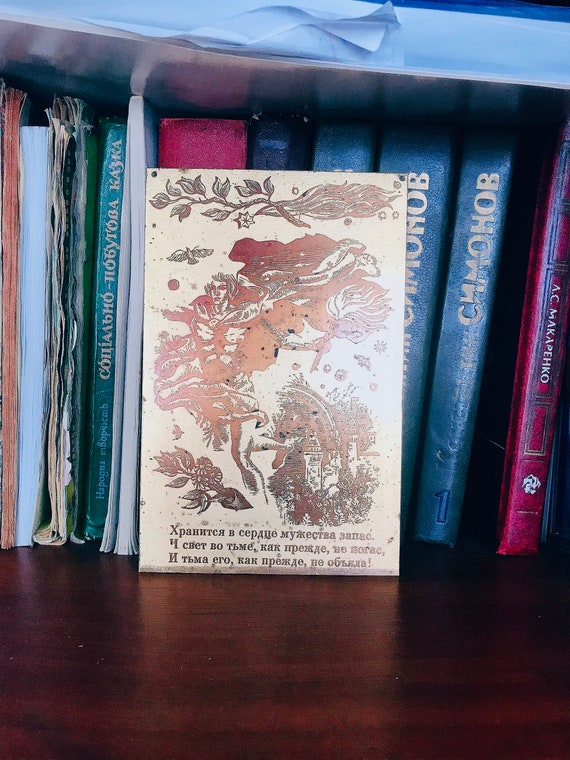
Locate an element on the screen. wood grain is located at coordinates (185, 627), (218, 647), (211, 692), (309, 717).